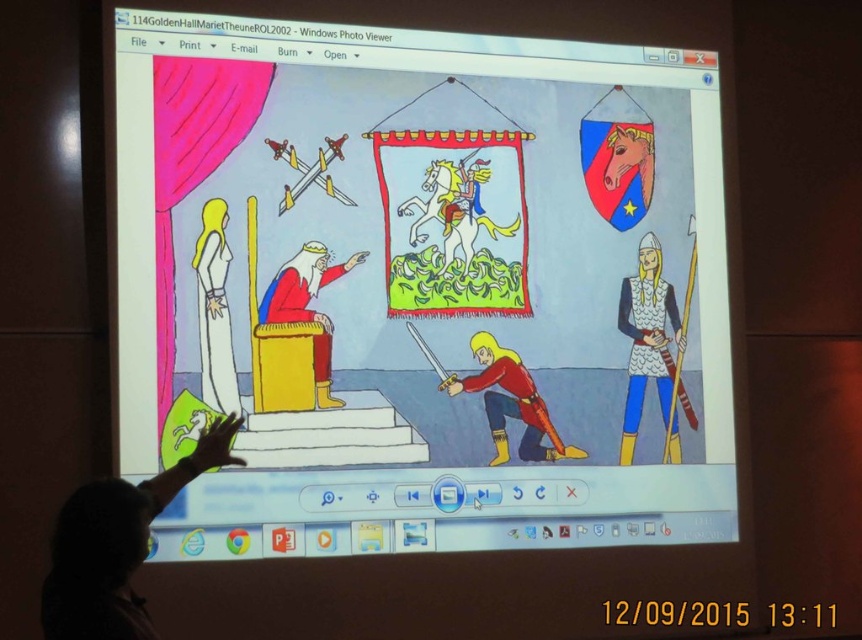
In the slide presentation, there is a metallic chainmail armor at right and a white glossy dress at upper left. Which object takes up more space in the image?

The metallic chainmail armor at right is larger in size than the white glossy dress at upper left, so it takes up more space in the image.

You are an attendee at the presentation looking at the slide. The shiny red armor at lower center and the matte red fabric throne at center are both in the image. Which object is positioned closer to the front of the slide?

The shiny red armor at lower center is positioned closer to the front of the slide because the matte red fabric throne at center is behind it.